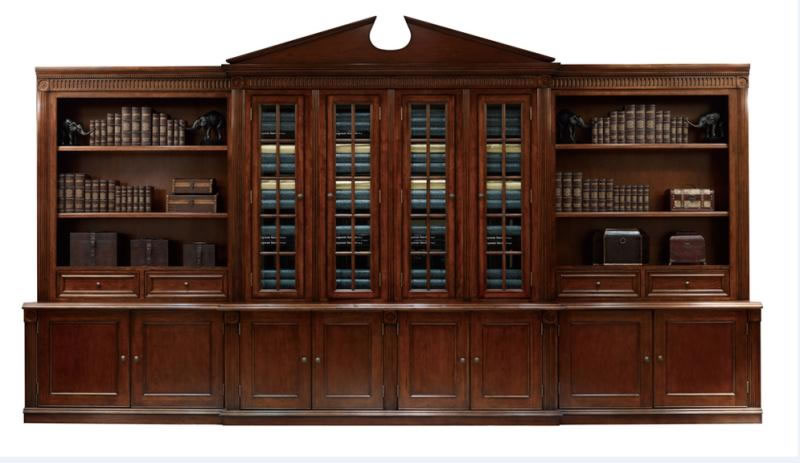
I want to click on shelves in bookcase, so click(x=130, y=148), click(x=129, y=288), click(x=616, y=262), click(x=616, y=205), click(x=606, y=143), click(x=442, y=250), click(x=440, y=212), click(x=434, y=174), click(x=438, y=137).